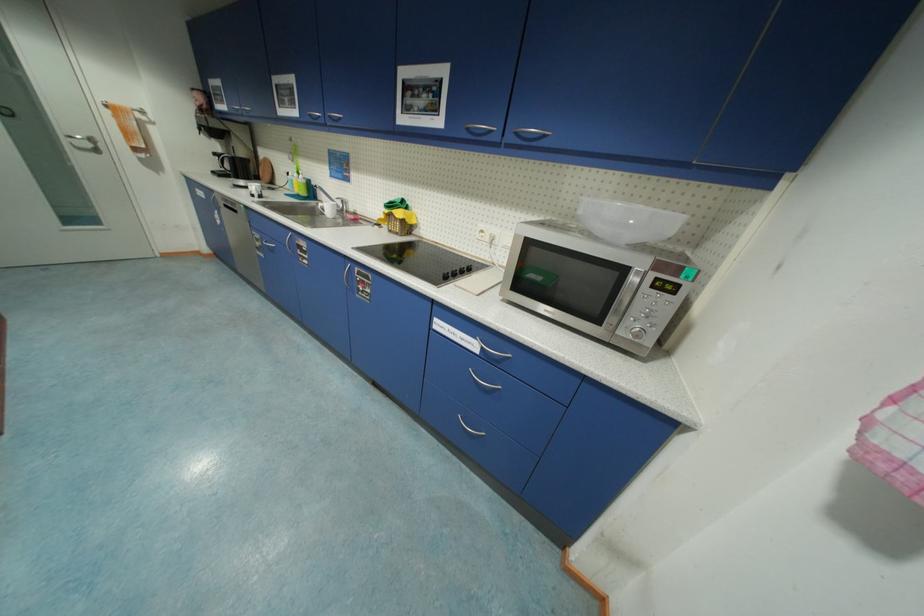
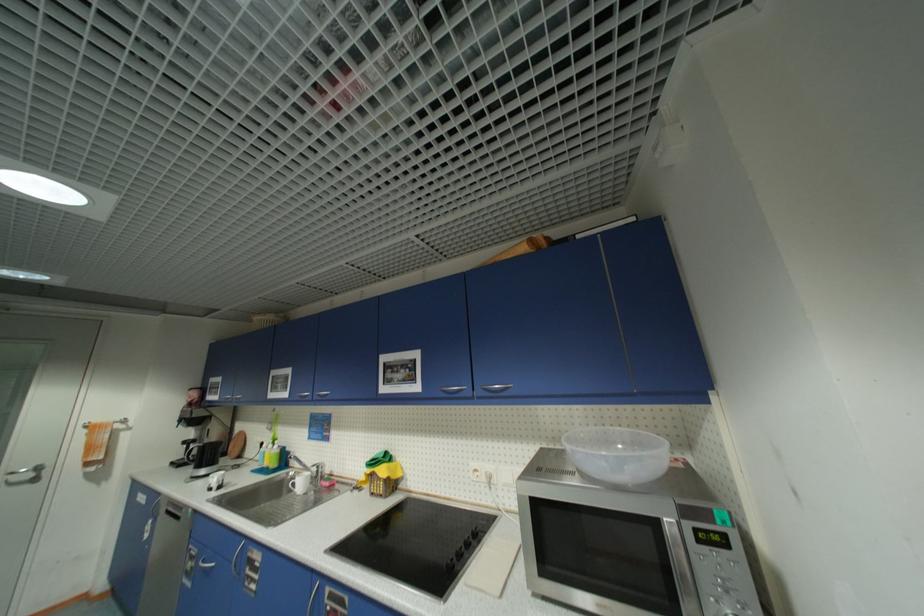
Where in the second image is the point corresponding to point (70, 140) from the first image?

(7, 479)